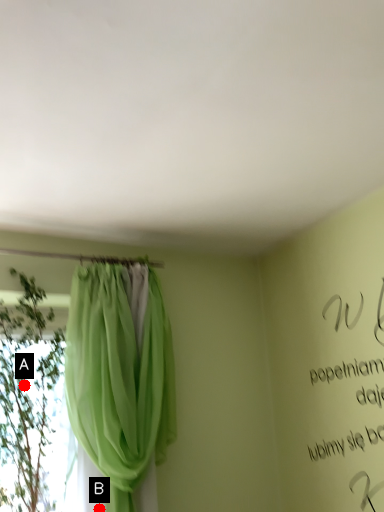
Question: Two points are circled on the image, labeled by A and B beside each circle. Among these points, which one is nearest to the camera?

Choices:
 (A) A is closer
 (B) B is closer

Answer: (B)